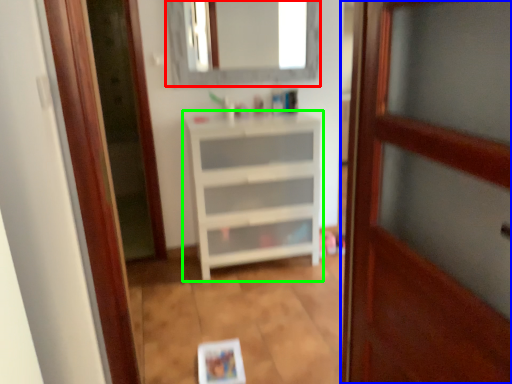
Question: Which is farther away from mirror (highlighted by a red box)? door (highlighted by a blue box) or chest of drawers (highlighted by a green box)?

Choices:
 (A) door
 (B) chest of drawers

Answer: (A)